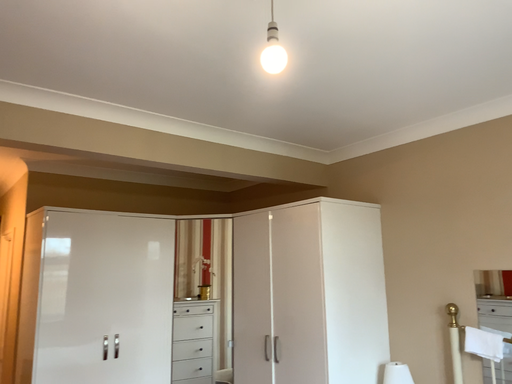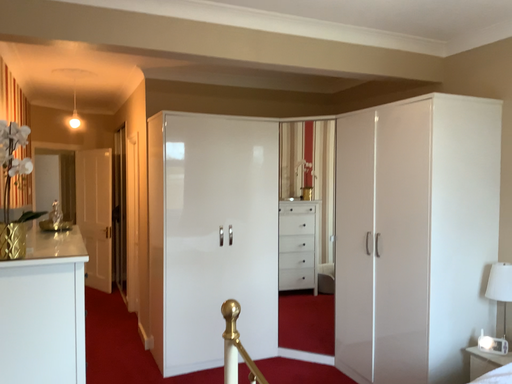
Question: Which way did the camera rotate in the video?

Choices:
 (A) rotated upward
 (B) rotated downward

Answer: (B)